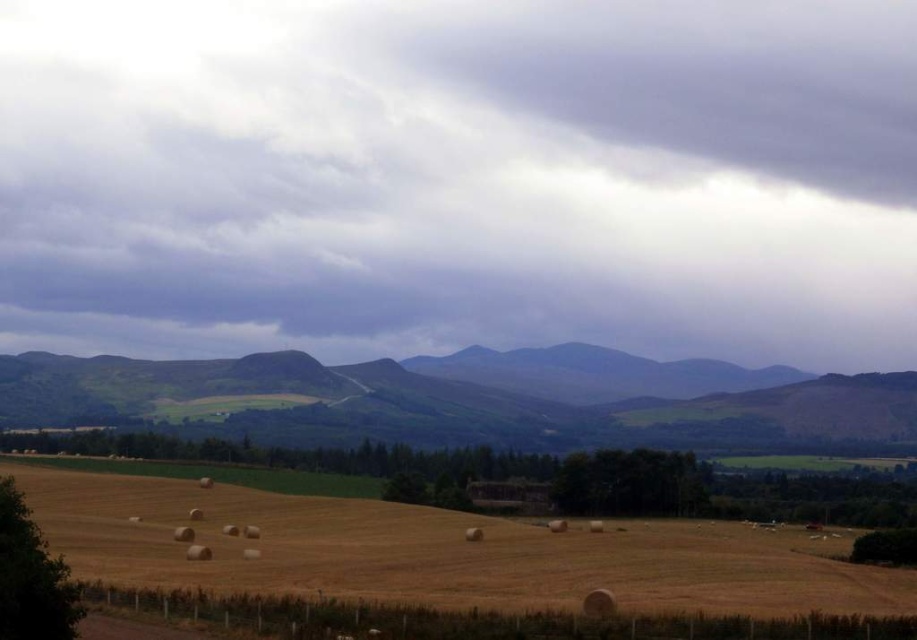
Question: Which of the following is the farthest from the observer?

Choices:
 (A) gray cloudy sky at upper center
 (B) yellow straw bales at lower center

Answer: (A)

Question: Which point appears farthest from the camera in this image?

Choices:
 (A) (779, 582)
 (B) (578, 404)
 (C) (381, 337)

Answer: (C)

Question: Which of these objects is positioned farthest from the yellow straw bales at lower center?

Choices:
 (A) gray cloudy sky at upper center
 (B) green grassy hill at center

Answer: (A)

Question: Is gray cloudy sky at upper center in front of yellow straw bales at lower center?

Choices:
 (A) yes
 (B) no

Answer: (B)

Question: Can you confirm if gray cloudy sky at upper center is smaller than green grassy hill at center?

Choices:
 (A) yes
 (B) no

Answer: (B)

Question: Is gray cloudy sky at upper center thinner than yellow straw bales at lower center?

Choices:
 (A) yes
 (B) no

Answer: (B)